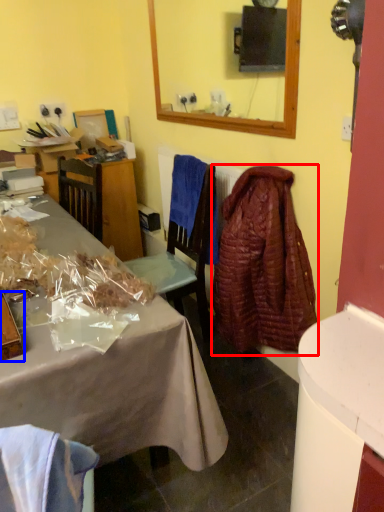
Question: Which point is further to the camera, robe (highlighted by a red box) or box (highlighted by a blue box)?

Choices:
 (A) robe
 (B) box

Answer: (A)